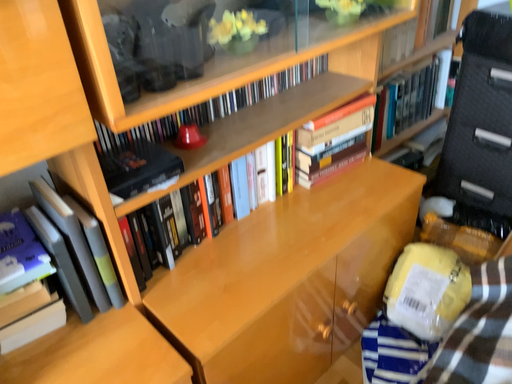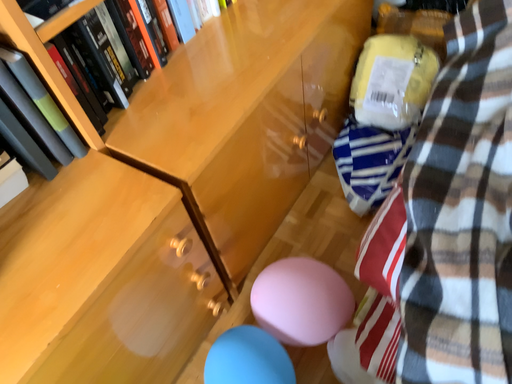
Question: Which way did the camera rotate in the video?

Choices:
 (A) rotated left
 (B) rotated right

Answer: (B)